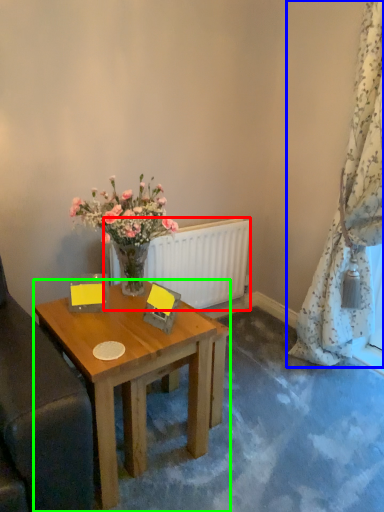
Question: Estimate the real-world distances between objects in this image. Which object is farther from radiator (highlighted by a red box), curtain (highlighted by a blue box) or desk (highlighted by a green box)?

Choices:
 (A) curtain
 (B) desk

Answer: (A)